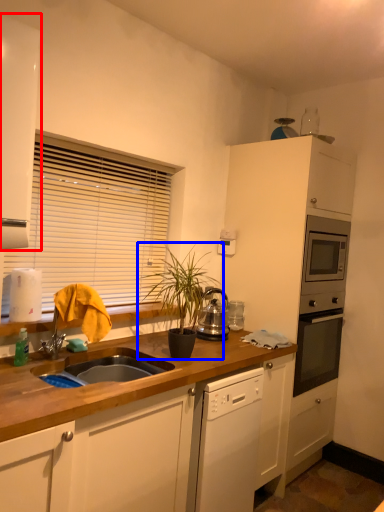
Question: Which object is closer to the camera taking this photo, cabinetry (highlighted by a red box) or houseplant (highlighted by a blue box)?

Choices:
 (A) cabinetry
 (B) houseplant

Answer: (A)